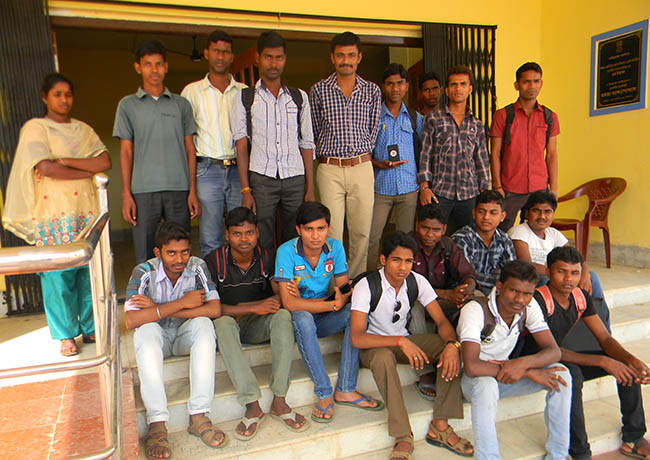
I want to click on stair, so click(x=231, y=455).